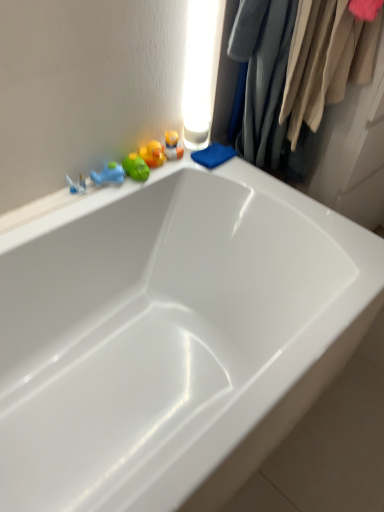
Question: From a real-world perspective, is green rubber duck at upper left, which is the first toy from left to right, physically located above or below translucent plastic toys at upper left, the 1th toy viewed from the right?

Choices:
 (A) below
 (B) above

Answer: (A)

Question: In the image, is green rubber duck at upper left, the third toy positioned from the right, positioned in front of or behind translucent plastic toys at upper left, acting as the 3th toy starting from the left?

Choices:
 (A) behind
 (B) front

Answer: (B)

Question: Estimate the real-world distances between objects in this image. Which object is closer to the green rubber duck at upper left, which is the first toy from left to right?

Choices:
 (A) white glossy bathtub at upper center
 (B) translucent plastic toys at upper left, acting as the 3th toy starting from the left
 (C) rubber duck at upper left, which is the second toy from left to right
 (D) velvet fabric clothes at upper right

Answer: (C)

Question: Which is farther from the green rubber duck at upper left, the third toy positioned from the right?

Choices:
 (A) velvet fabric clothes at upper right
 (B) translucent plastic toys at upper left, the 1th toy viewed from the right
 (C) rubber duck at upper left, the second toy viewed from the right
 (D) white glossy bathtub at upper center

Answer: (A)